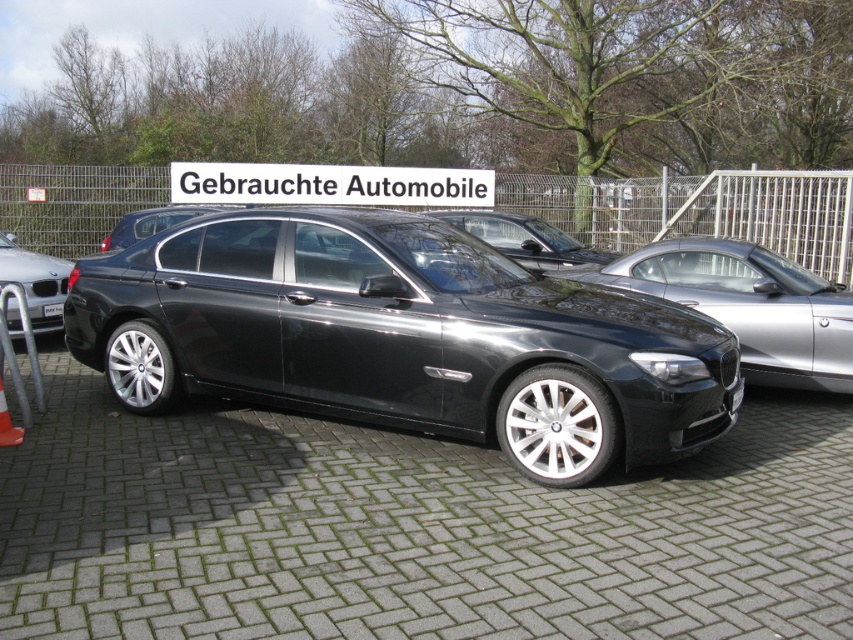
You are a photographer standing in front of the black BMW sedan at the used car lot. You want to take a photo that includes both the point at coordinates point (589, 246) and point (57, 305). Which point will appear closer to the top of the photo?

Point (589, 246) is further to the camera than point (57, 305), so it will appear closer to the top of the photo.

You are standing at the camera position and want to take a photo of the shiny metallic car at left. If your camera has a maximum focus range of 8 meters, will it be able to capture the car in focus?

The shiny metallic car at left and camera are 7.99 meters apart from each other, so yes, the camera can focus on the car as it is within the 8 meter range.